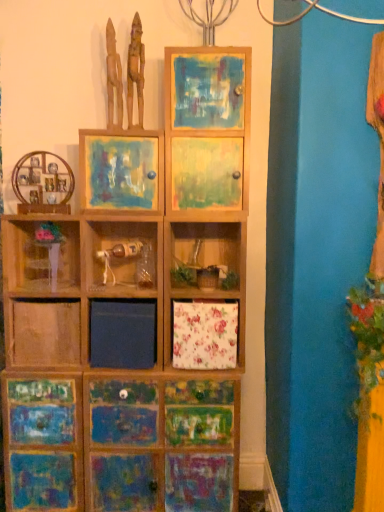
Question: Is wooden figure at upper left, the first sculpture in the right-to-left sequence, outside wooden painted cabinet at lower left, arranged as the first cabinetry when ordered from the bottom?

Choices:
 (A) yes
 (B) no

Answer: (A)

Question: Is wooden figure at upper left, the first sculpture in the right-to-left sequence, turned away from wooden painted cabinet at lower left, which appears as the 3th cabinetry when viewed from the top?

Choices:
 (A) no
 (B) yes

Answer: (A)

Question: From a real-world perspective, is wooden figure at upper left, positioned as the 2th sculpture in left-to-right order, over wooden painted cabinet at lower left, arranged as the first cabinetry when ordered from the bottom?

Choices:
 (A) no
 (B) yes

Answer: (B)

Question: Is wooden figure at upper left, positioned as the 2th sculpture in left-to-right order, behind wooden painted cabinet at lower left, which appears as the 3th cabinetry when viewed from the top?

Choices:
 (A) yes
 (B) no

Answer: (B)

Question: Considering the relative positions of wooden figure at upper left, positioned as the 2th sculpture in left-to-right order, and wooden painted cabinet at lower left, which appears as the 3th cabinetry when viewed from the top, in the image provided, is wooden figure at upper left, positioned as the 2th sculpture in left-to-right order, in front of wooden painted cabinet at lower left, which appears as the 3th cabinetry when viewed from the top,?

Choices:
 (A) no
 (B) yes

Answer: (B)

Question: From the image's perspective, is wooden figure at upper left, positioned as the 2th sculpture in left-to-right order, over wooden painted cabinet at lower left, arranged as the first cabinetry when ordered from the bottom?

Choices:
 (A) no
 (B) yes

Answer: (B)

Question: From a real-world perspective, is wooden painted cabinet at lower left, arranged as the first cabinetry when ordered from the bottom, over wooden figurines at upper center, which is counted as the 1th sculpture, starting from the left?

Choices:
 (A) no
 (B) yes

Answer: (A)

Question: From the image's perspective, is wooden painted cabinet at lower left, arranged as the first cabinetry when ordered from the bottom, below wooden figurines at upper center, acting as the 2th sculpture starting from the right?

Choices:
 (A) yes
 (B) no

Answer: (A)

Question: Is wooden painted cabinet at lower left, arranged as the first cabinetry when ordered from the bottom, with wooden figurines at upper center, acting as the 2th sculpture starting from the right?

Choices:
 (A) yes
 (B) no

Answer: (B)

Question: Is wooden painted cabinet at lower left, which appears as the 3th cabinetry when viewed from the top, not inside wooden figurines at upper center, which is counted as the 1th sculpture, starting from the left?

Choices:
 (A) yes
 (B) no

Answer: (A)

Question: Is wooden painted cabinet at lower left, arranged as the first cabinetry when ordered from the bottom, positioned behind wooden figurines at upper center, acting as the 2th sculpture starting from the right?

Choices:
 (A) yes
 (B) no

Answer: (A)

Question: Considering the relative sizes of wooden painted cabinet at lower left, which appears as the 3th cabinetry when viewed from the top, and wooden figurines at upper center, which is counted as the 1th sculpture, starting from the left, in the image provided, is wooden painted cabinet at lower left, which appears as the 3th cabinetry when viewed from the top, smaller than wooden figurines at upper center, which is counted as the 1th sculpture, starting from the left,?

Choices:
 (A) yes
 (B) no

Answer: (B)

Question: Is wooden shelf at left, marked as the 3th cabinetry in a bottom-to-top arrangement, directly adjacent to painted wood cabinet at upper center?

Choices:
 (A) no
 (B) yes

Answer: (A)